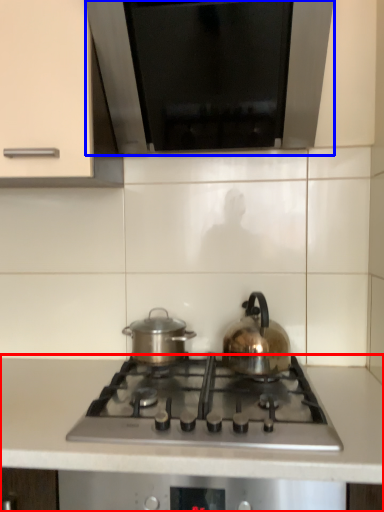
Question: Which of the following is the farthest to the observer, countertop (highlighted by a red box) or exhaust hood (highlighted by a blue box)?

Choices:
 (A) countertop
 (B) exhaust hood

Answer: (B)